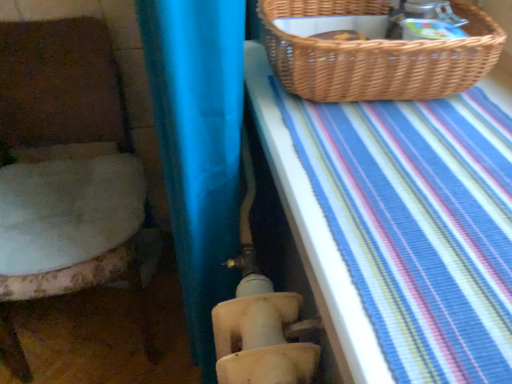
Question: From the image's perspective, is woven brown picnic basket at upper right located above or below fluffy white cushion at left?

Choices:
 (A) below
 (B) above

Answer: (B)

Question: Considering the positions of woven brown picnic basket at upper right and fluffy white cushion at left in the image, is woven brown picnic basket at upper right wider or thinner than fluffy white cushion at left?

Choices:
 (A) wide
 (B) thin

Answer: (B)

Question: Based on their relative distances, which object is farther from the fluffy white cushion at left?

Choices:
 (A) woven brown picnic basket at upper right
 (B) blue striped fabric at upper right

Answer: (A)

Question: Which object is the closest to the blue striped fabric at upper right?

Choices:
 (A) fluffy white cushion at left
 (B) woven brown picnic basket at upper right

Answer: (B)